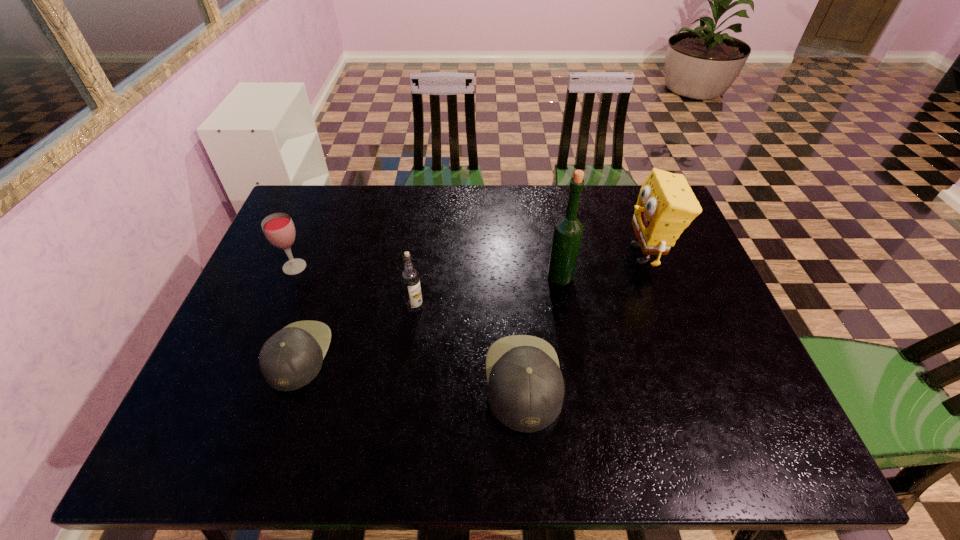
In order to click on the left cap in this screenshot , I will do `click(290, 359)`.

You are a GUI agent. You are given a task and a screenshot of the screen. Output one action in this format:
    pyautogui.click(x=<x>, y=<y>)
    Task: Click on the shorter cap
    
    Given the screenshot: What is the action you would take?
    pyautogui.click(x=290, y=359)

Image resolution: width=960 pixels, height=540 pixels. Find the location of `the right cap`. the right cap is located at coordinates (526, 390).

Locate an element on the screen. The image size is (960, 540). the fourth object from left to right is located at coordinates (526, 390).

Find the location of `the second object from right to left`. the second object from right to left is located at coordinates (568, 230).

You are a GUI agent. You are given a task and a screenshot of the screen. Output one action in this format:
    pyautogui.click(x=<x>, y=<y>)
    Task: Click on the tallest object
    
    Given the screenshot: What is the action you would take?
    pyautogui.click(x=568, y=230)

Identify the location of vodka. The height and width of the screenshot is (540, 960). (410, 277).

Where is `the fourth object from right to left`? Image resolution: width=960 pixels, height=540 pixels. the fourth object from right to left is located at coordinates (410, 277).

At what (x,y) coordinates should I click in order to perform the action: click on the fifth shortest object. Please return your answer as a coordinate pair (x, y). The image size is (960, 540). Looking at the image, I should click on (666, 205).

The image size is (960, 540). Identify the location of the rightmost object. click(666, 205).